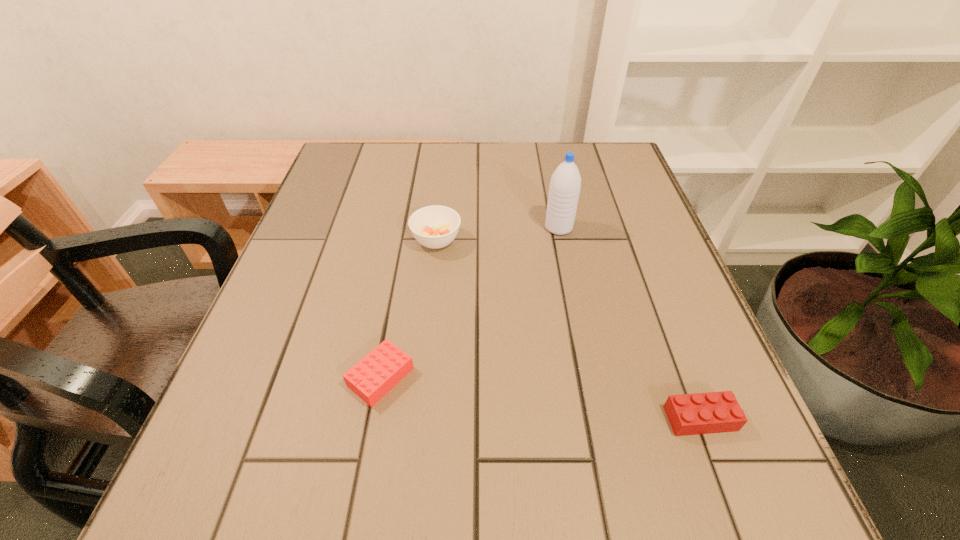
Where is `the second object from right to left`? The image size is (960, 540). the second object from right to left is located at coordinates (565, 184).

You are a GUI agent. You are given a task and a screenshot of the screen. Output one action in this format:
    pyautogui.click(x=<x>, y=<y>)
    Task: Click on the water bottle
    
    Given the screenshot: What is the action you would take?
    pyautogui.click(x=565, y=184)

Locate an element on the screen. This screenshot has width=960, height=540. the second tallest object is located at coordinates (436, 226).

Where is `the rightmost object`? This screenshot has height=540, width=960. the rightmost object is located at coordinates (714, 412).

Locate an element on the screen. This screenshot has width=960, height=540. the left Lego is located at coordinates (378, 372).

This screenshot has width=960, height=540. Identify the location of vacant space located on the left of the third object from left to right. 450,228.

What are the coordinates of `vacant space located on the back of the soup bowl` in the screenshot? It's located at (445, 153).

At what (x,y) coordinates should I click in order to perform the action: click on free region located 0.300m on the left of the right Lego. Please return your answer as a coordinate pair (x, y). The height and width of the screenshot is (540, 960). Looking at the image, I should click on (476, 418).

Where is `free location located on the left of the left Lego`? Image resolution: width=960 pixels, height=540 pixels. free location located on the left of the left Lego is located at coordinates (296, 377).

Locate an element on the screen. The image size is (960, 540). object at the right edge is located at coordinates (714, 412).